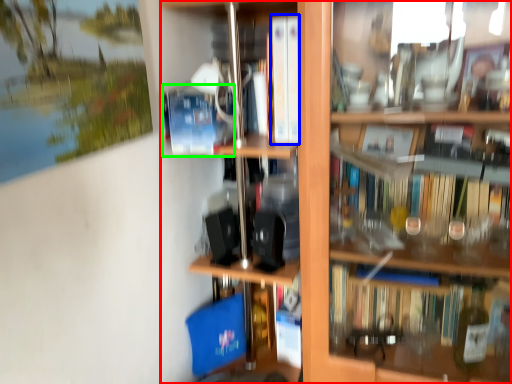
Question: Which object is the farthest from shelf (highlighted by a red box)? Choose among these: book (highlighted by a blue box) or paperback book (highlighted by a green box).

Choices:
 (A) book
 (B) paperback book

Answer: (B)